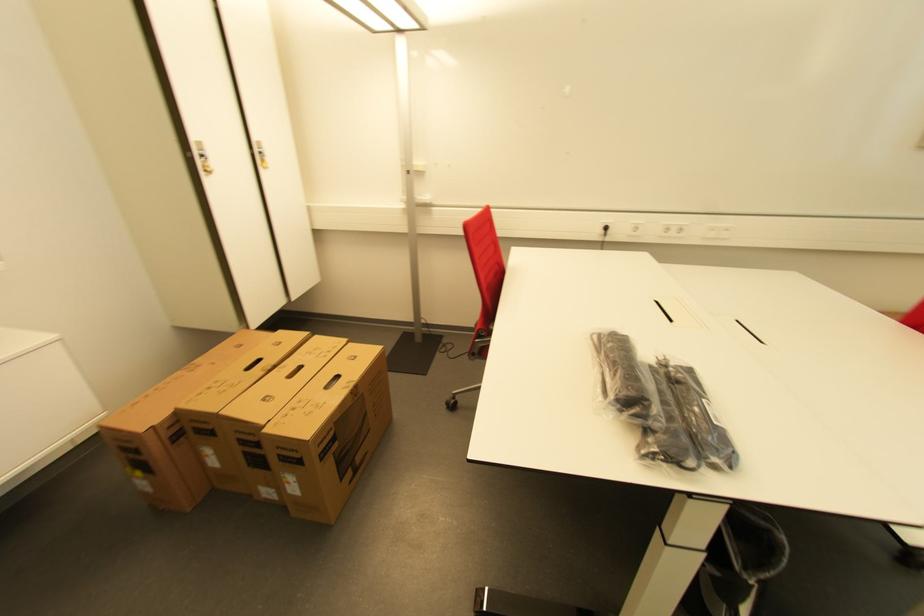
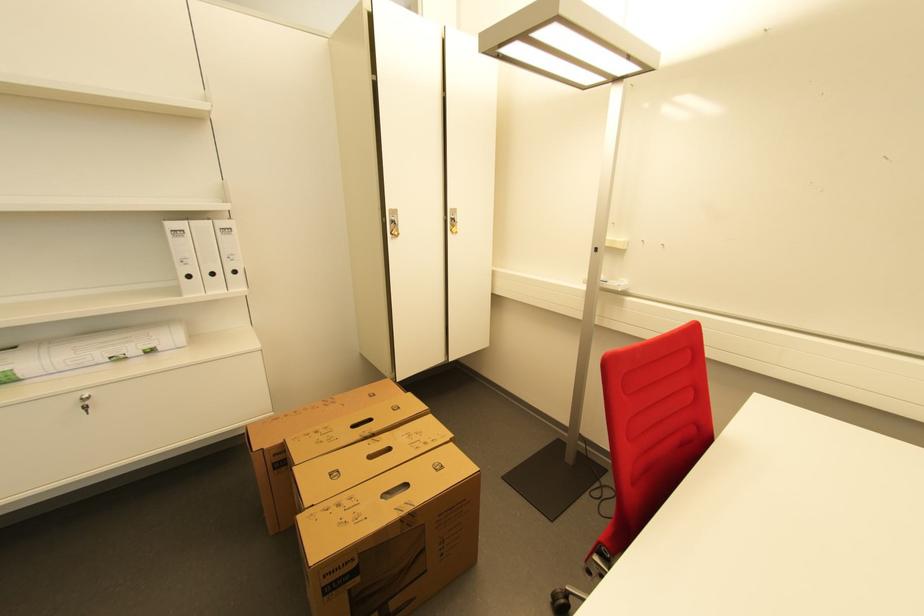
Question: The camera is either moving clockwise (left) or counter-clockwise (right) around the object. The first image is from the beginning of the video and the second image is from the end. Is the camera moving left or right when shooting the video?

Choices:
 (A) Left
 (B) Right

Answer: (B)